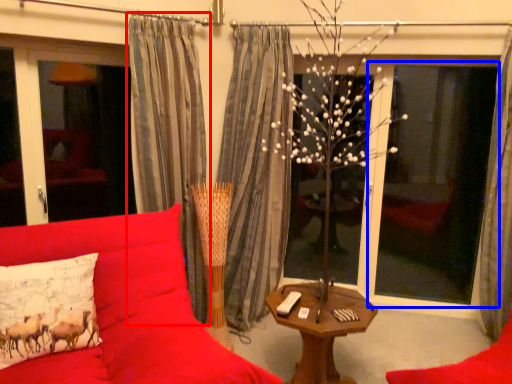
Question: Which of the following is the farthest to the observer, curtain (highlighted by a red box) or window screen (highlighted by a blue box)?

Choices:
 (A) curtain
 (B) window screen

Answer: (B)